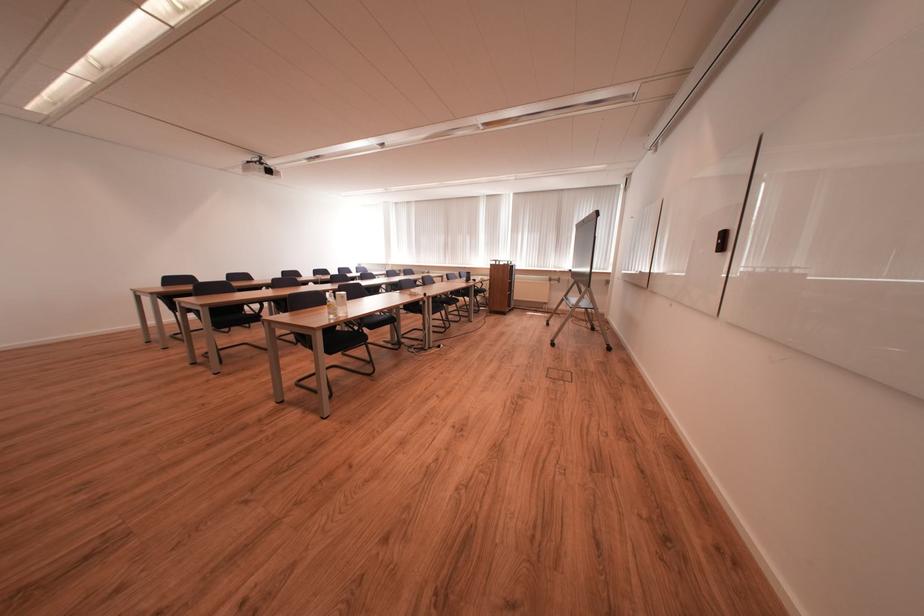
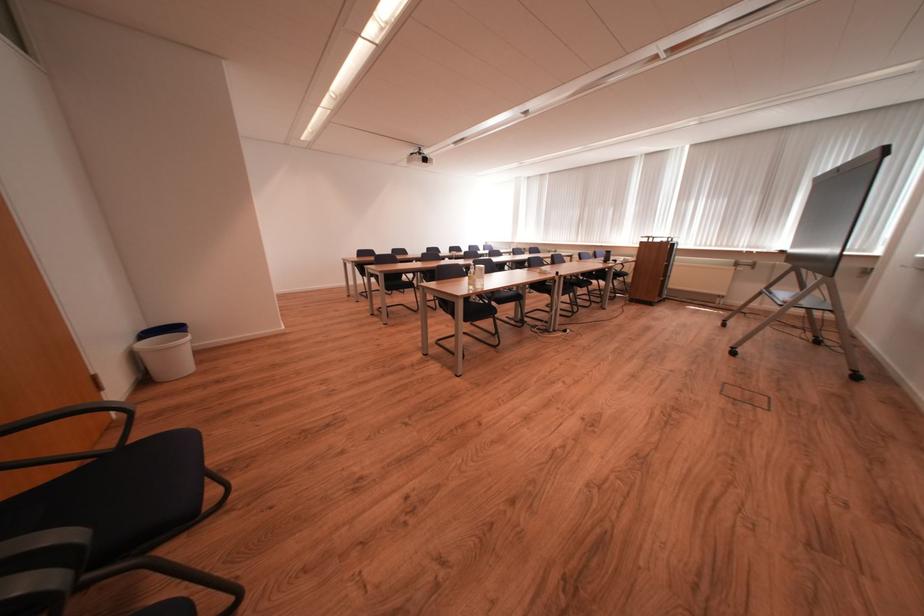
Question: Based on the continuous images, in which direction is the camera rotating? Reply with the corresponding letter.

Choices:
 (A) Left
 (B) Right
 (C) Up
 (D) Down

Answer: (A)